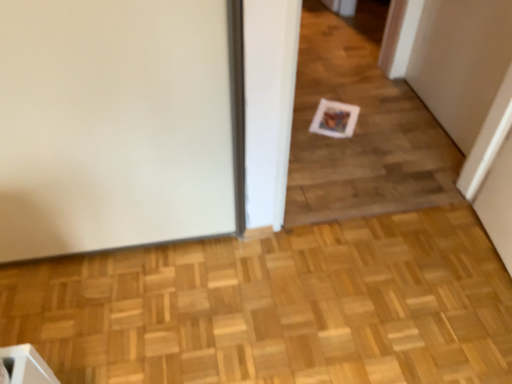
Where is `natural wood flooring at lower center`? The image size is (512, 384). natural wood flooring at lower center is located at coordinates (276, 307).

This screenshot has width=512, height=384. Describe the element at coordinates (276, 307) in the screenshot. I see `natural wood flooring at lower center` at that location.

Identify the location of natural wood flooring at lower center. (276, 307).